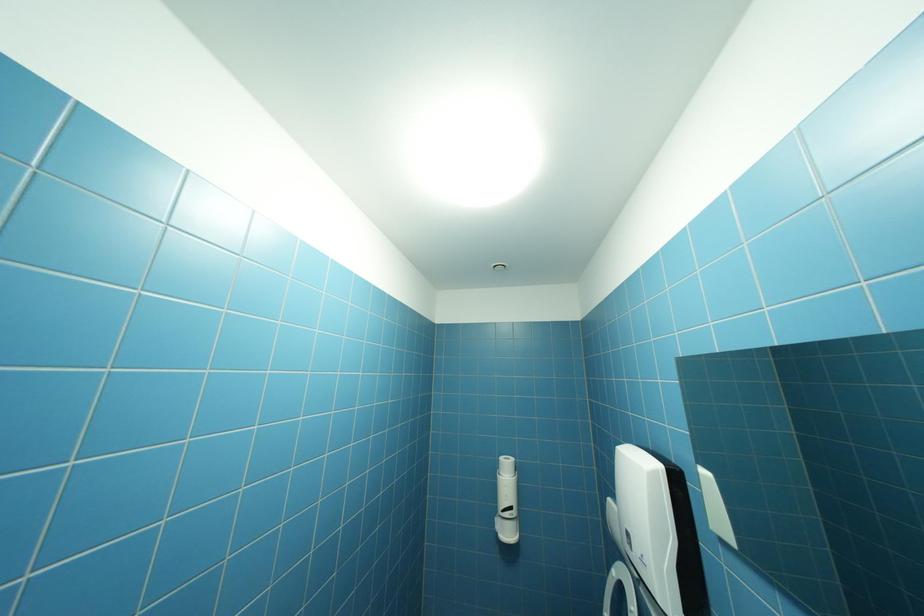
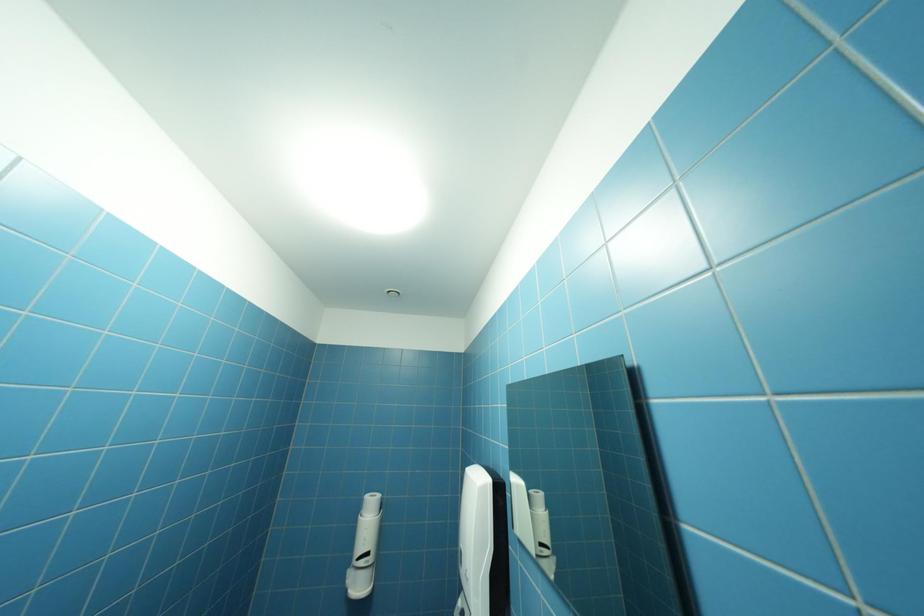
What movement of the cameraman would produce the second image?

The cameraman walked toward right, backward.